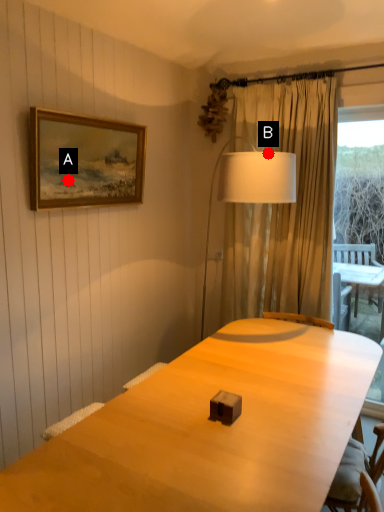
Question: Two points are circled on the image, labeled by A and B beside each circle. Which point appears farthest from the camera in this image?

Choices:
 (A) A is further
 (B) B is further

Answer: (B)